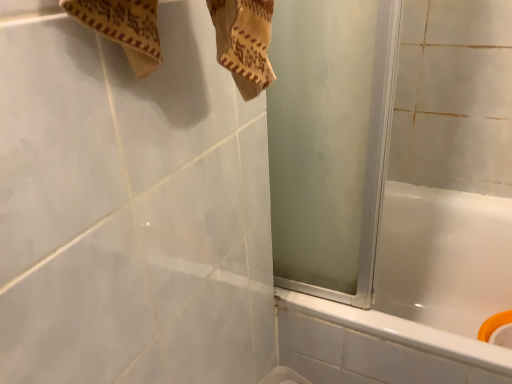
Identify the location of white glossy bathtub at center. The image size is (512, 384). (416, 297).

The width and height of the screenshot is (512, 384). Describe the element at coordinates (416, 297) in the screenshot. I see `white glossy bathtub at center` at that location.

What is the approximate width of white glossy bathtub at center?

white glossy bathtub at center is 28.22 inches in width.

Locate an element on the screen. white glossy bathtub at center is located at coordinates coord(416,297).